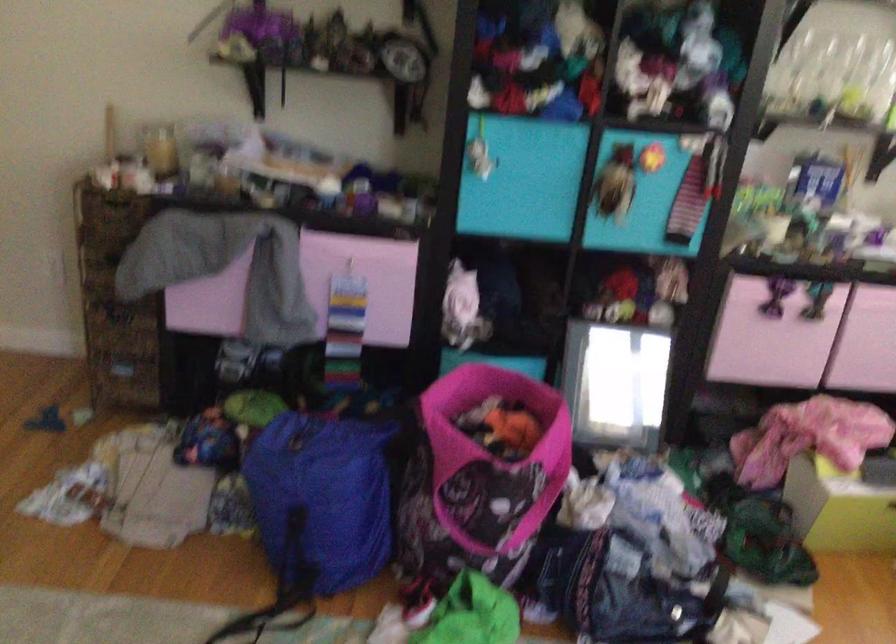
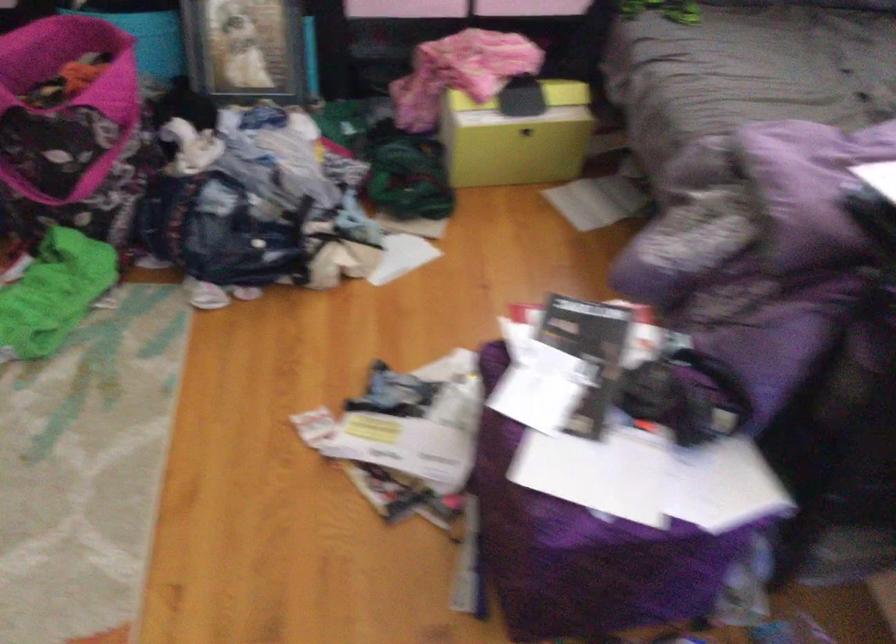
Locate, in the second image, the point that corresponds to (554,424) in the first image.

(124, 67)